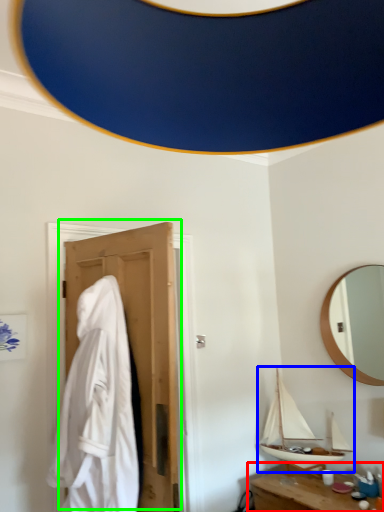
Question: Considering the real-world distances, which object is farthest from table (highlighted by a red box)? boat (highlighted by a blue box) or door (highlighted by a green box)?

Choices:
 (A) boat
 (B) door

Answer: (B)